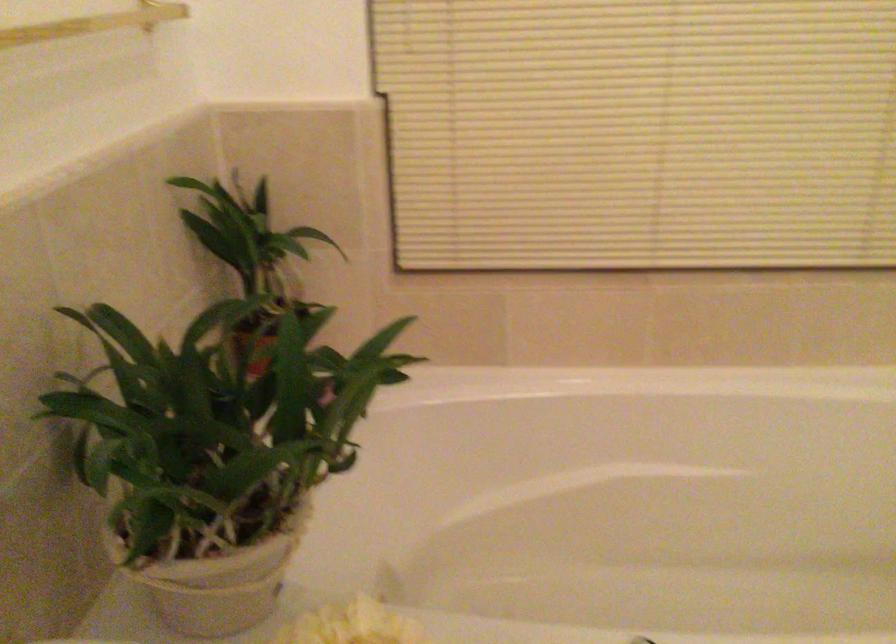
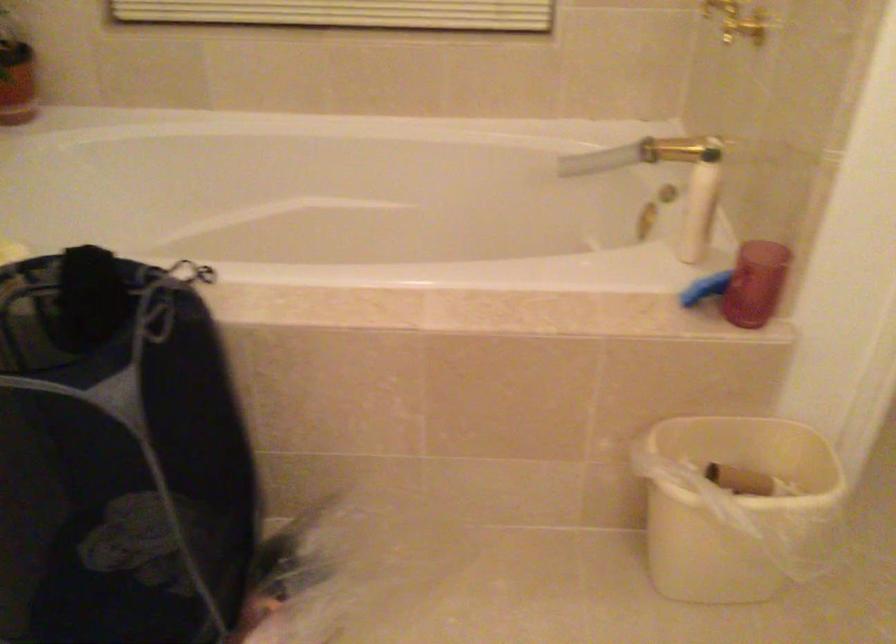
Question: How did the camera likely rotate?

Choices:
 (A) Left
 (B) Right
 (C) Up
 (D) Down

Answer: (D)